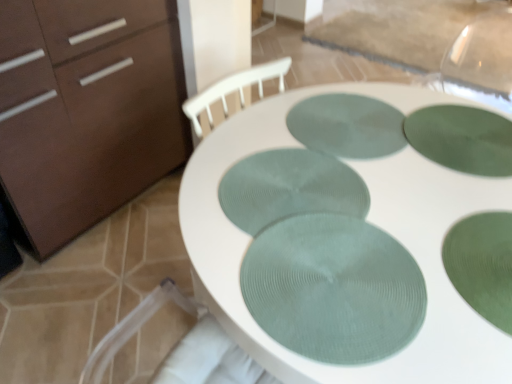
At what (x,y) coordinates should I click in order to perform the action: click on unoccupied area in front of green textured placemat at center, which is the fifth glass plate in front-to-back order. Please return your answer as a coordinate pair (x, y). The image size is (512, 384). Looking at the image, I should click on (367, 199).